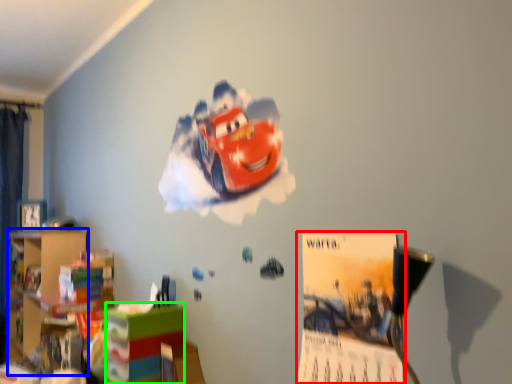
Question: Which object is the closest to the poster page (highlighted by a red box)? Choose among these: bookshelf (highlighted by a blue box) or shelf (highlighted by a green box).

Choices:
 (A) bookshelf
 (B) shelf

Answer: (B)